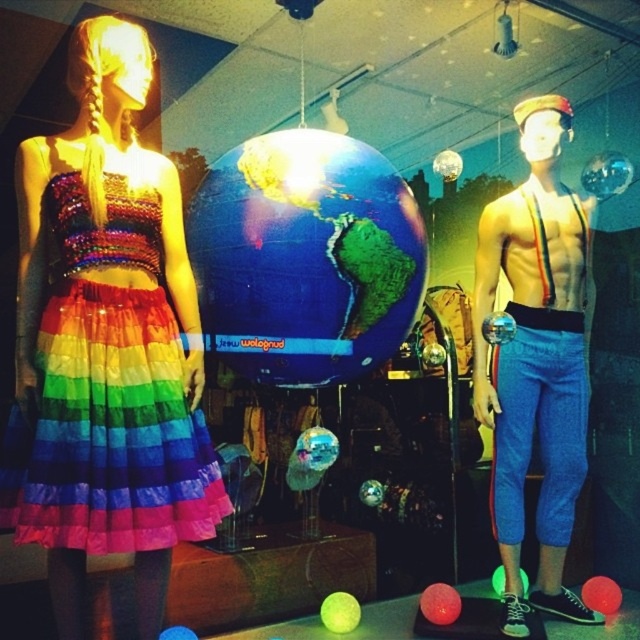
Between rainbow tulle skirt at left and glossy plastic globe at center, which one appears on the right side from the viewer's perspective?

From the viewer's perspective, glossy plastic globe at center appears more on the right side.

Who is higher up, rainbow tulle skirt at left or glossy plastic globe at center?

glossy plastic globe at center

Locate an element on the screen. The height and width of the screenshot is (640, 640). rainbow tulle skirt at left is located at coordinates (108, 397).

Where is `rainbow tulle skirt at left`? Image resolution: width=640 pixels, height=640 pixels. rainbow tulle skirt at left is located at coordinates (108, 397).

Who is lower down, rainbow tulle skirt at left or shiny blue pants at right?

Positioned lower is rainbow tulle skirt at left.

Can you confirm if rainbow tulle skirt at left is bigger than shiny blue pants at right?

No, rainbow tulle skirt at left is not bigger than shiny blue pants at right.

This screenshot has height=640, width=640. Identify the location of rainbow tulle skirt at left. (108, 397).

You are a GUI agent. You are given a task and a screenshot of the screen. Output one action in this format:
    pyautogui.click(x=<x>, y=<y>)
    Task: Click on the rainbow tulle skirt at left
    Image resolution: width=640 pixels, height=640 pixels.
    Given the screenshot: What is the action you would take?
    pyautogui.click(x=108, y=397)

Between glossy plastic globe at center and shiny blue pants at right, which one is positioned higher?

glossy plastic globe at center

Can you confirm if glossy plastic globe at center is positioned to the right of shiny blue pants at right?

No, glossy plastic globe at center is not to the right of shiny blue pants at right.

Describe the element at coordinates (305, 257) in the screenshot. The image size is (640, 640). I see `glossy plastic globe at center` at that location.

Image resolution: width=640 pixels, height=640 pixels. What are the coordinates of `glossy plastic globe at center` in the screenshot? It's located at (305, 257).